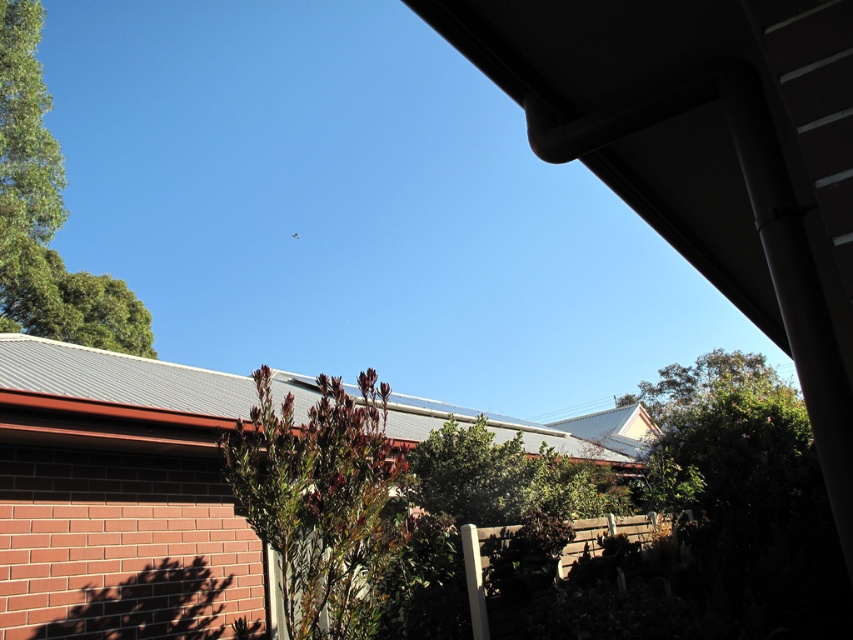
From the picture: Does green leafy bush at center appear over green leafy tree at upper left?

Incorrect, green leafy bush at center is not positioned above green leafy tree at upper left.

Measure the distance between green leafy bush at center and camera.

3.80 meters

This screenshot has width=853, height=640. Identify the location of green leafy bush at center. pos(321,500).